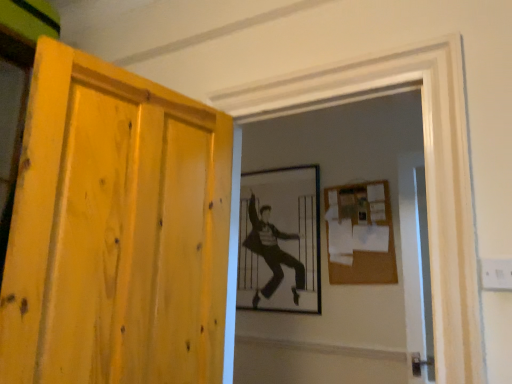
Question: Considering the relative sizes of burlap-like brown bulletin board at upper right and transparent glass screen door at right in the image provided, is burlap-like brown bulletin board at upper right thinner than transparent glass screen door at right?

Choices:
 (A) no
 (B) yes

Answer: (B)

Question: Is burlap-like brown bulletin board at upper right next to transparent glass screen door at right and touching it?

Choices:
 (A) no
 (B) yes

Answer: (A)

Question: Can you confirm if burlap-like brown bulletin board at upper right is shorter than transparent glass screen door at right?

Choices:
 (A) yes
 (B) no

Answer: (A)

Question: Is burlap-like brown bulletin board at upper right closer to the viewer compared to transparent glass screen door at right?

Choices:
 (A) no
 (B) yes

Answer: (A)

Question: Can you confirm if burlap-like brown bulletin board at upper right is bigger than transparent glass screen door at right?

Choices:
 (A) no
 (B) yes

Answer: (A)

Question: Would you say burlap-like brown bulletin board at upper right is a long distance from transparent glass screen door at right?

Choices:
 (A) yes
 (B) no

Answer: (B)

Question: Does black and white photograph of a man at center have a lesser height compared to burlap-like brown bulletin board at upper right?

Choices:
 (A) yes
 (B) no

Answer: (B)

Question: Could you tell me if black and white photograph of a man at center is facing burlap-like brown bulletin board at upper right?

Choices:
 (A) no
 (B) yes

Answer: (A)

Question: Can you confirm if black and white photograph of a man at center is thinner than burlap-like brown bulletin board at upper right?

Choices:
 (A) no
 (B) yes

Answer: (A)

Question: Is black and white photograph of a man at center looking in the opposite direction of burlap-like brown bulletin board at upper right?

Choices:
 (A) yes
 (B) no

Answer: (B)

Question: Is black and white photograph of a man at center not inside burlap-like brown bulletin board at upper right?

Choices:
 (A) no
 (B) yes

Answer: (B)

Question: Is burlap-like brown bulletin board at upper right located within black and white photograph of a man at center?

Choices:
 (A) yes
 (B) no

Answer: (B)

Question: Would you say transparent glass screen door at right is a long distance from black and white photograph of a man at center?

Choices:
 (A) no
 (B) yes

Answer: (A)